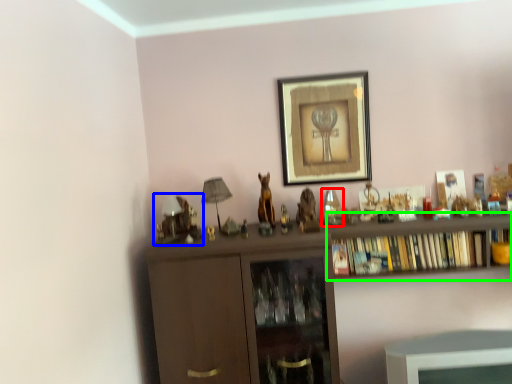
Question: Estimate the real-world distances between objects in this image. Which object is farther from toy (highlighted by a red box), toy (highlighted by a blue box) or shelf (highlighted by a green box)?

Choices:
 (A) toy
 (B) shelf

Answer: (A)